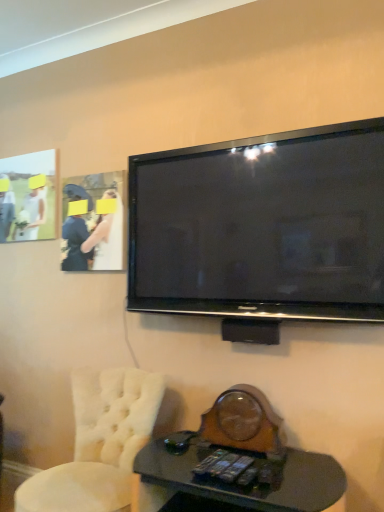
Question: Considering the relative sizes of black glass desk at lower center and matte white picture frame at upper left in the image provided, is black glass desk at lower center shorter than matte white picture frame at upper left?

Choices:
 (A) no
 (B) yes

Answer: (B)

Question: Is black glass desk at lower center at the left side of matte white picture frame at upper left?

Choices:
 (A) yes
 (B) no

Answer: (B)

Question: Is black glass desk at lower center touching matte white picture frame at upper left?

Choices:
 (A) no
 (B) yes

Answer: (A)

Question: Is black glass desk at lower center to the right of matte white picture frame at upper left from the viewer's perspective?

Choices:
 (A) no
 (B) yes

Answer: (B)

Question: Considering the relative positions of black glass desk at lower center and matte white picture frame at upper left in the image provided, is black glass desk at lower center behind matte white picture frame at upper left?

Choices:
 (A) yes
 (B) no

Answer: (B)

Question: From the image's perspective, would you say black glass desk at lower center is shown under matte white picture frame at upper left?

Choices:
 (A) no
 (B) yes

Answer: (B)

Question: From the image's perspective, is black glossy flat-screen tv at upper center beneath white tufted chair at lower left?

Choices:
 (A) yes
 (B) no

Answer: (B)

Question: Does black glossy flat-screen tv at upper center appear on the left side of white tufted chair at lower left?

Choices:
 (A) yes
 (B) no

Answer: (B)

Question: Is black glossy flat-screen tv at upper center facing towards white tufted chair at lower left?

Choices:
 (A) no
 (B) yes

Answer: (A)

Question: From a real-world perspective, is black glossy flat-screen tv at upper center on white tufted chair at lower left?

Choices:
 (A) yes
 (B) no

Answer: (A)

Question: Can you confirm if black glossy flat-screen tv at upper center is taller than white tufted chair at lower left?

Choices:
 (A) yes
 (B) no

Answer: (A)

Question: Considering the relative sizes of black glossy flat-screen tv at upper center and white tufted chair at lower left in the image provided, is black glossy flat-screen tv at upper center thinner than white tufted chair at lower left?

Choices:
 (A) yes
 (B) no

Answer: (A)

Question: Is black glass desk at lower center shorter than matte white dress at upper left?

Choices:
 (A) no
 (B) yes

Answer: (B)